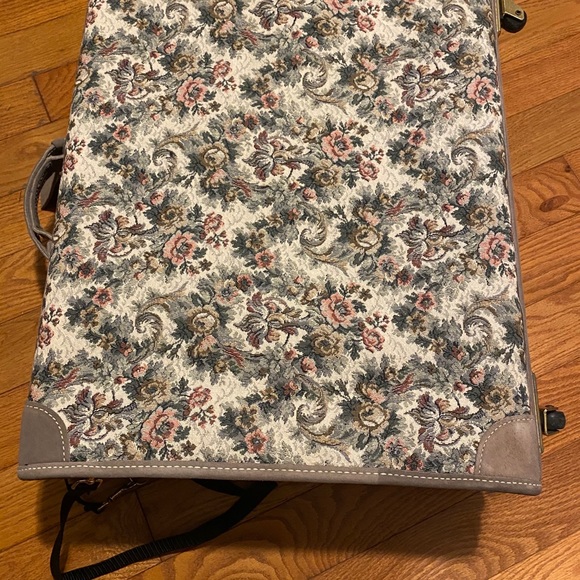
Where is `wheeled luggage`? wheeled luggage is located at coordinates (377, 170).